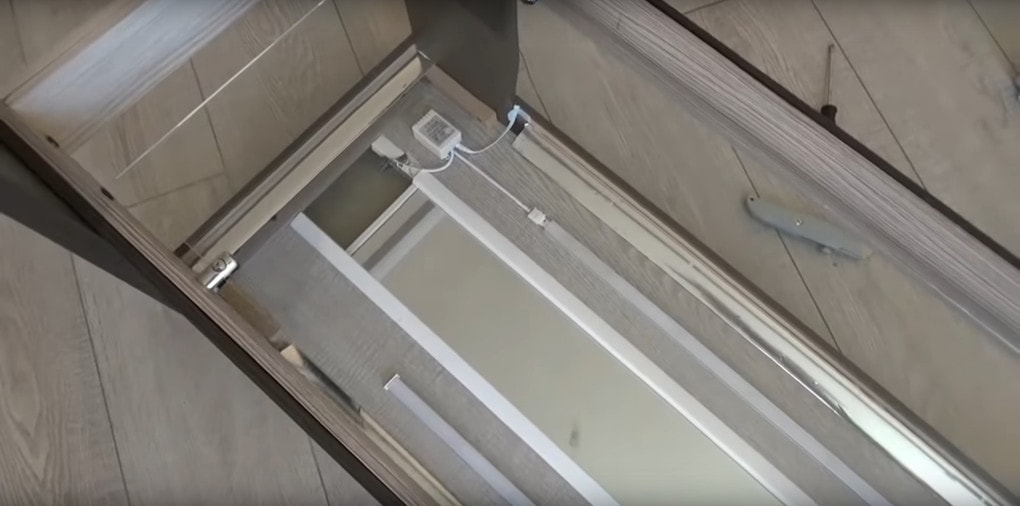
At what (x,y) coordinates should I click in order to perform the action: click on box. Please return your answer as a coordinate pair (x, y). This screenshot has width=1020, height=506. Looking at the image, I should click on (437, 129).